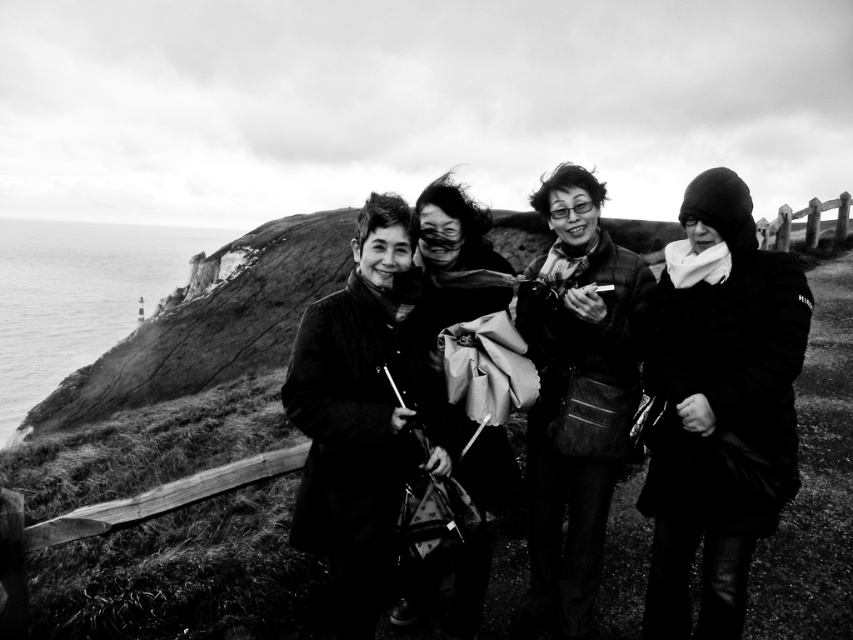
Does point (392, 477) lie in front of point (460, 310)?

Yes, it is.

Which is behind, point (399, 364) or point (466, 234)?

The point (466, 234) is behind.

What do you see at coordinates (358, 413) in the screenshot?
I see `velvet black coat at center` at bounding box center [358, 413].

The height and width of the screenshot is (640, 853). I want to click on velvet black coat at center, so click(x=358, y=413).

Between point (697, 294) and point (368, 305), which one is positioned behind?

The point (368, 305) is behind.

Where is `black woolen coat at right`? Image resolution: width=853 pixels, height=640 pixels. black woolen coat at right is located at coordinates pyautogui.click(x=718, y=406).

The width and height of the screenshot is (853, 640). Find the location of `black woolen coat at right`. black woolen coat at right is located at coordinates (718, 406).

Can you confirm if black woolen coat at right is positioned above matte black jacket at center?

Incorrect, black woolen coat at right is not positioned above matte black jacket at center.

In order to click on black woolen coat at right in this screenshot , I will do (x=718, y=406).

At what (x,y) coordinates should I click in order to perform the action: click on black woolen coat at right. Please return your answer as a coordinate pair (x, y). The image size is (853, 640). Looking at the image, I should click on (718, 406).

The height and width of the screenshot is (640, 853). Identify the location of black woolen coat at right. (718, 406).